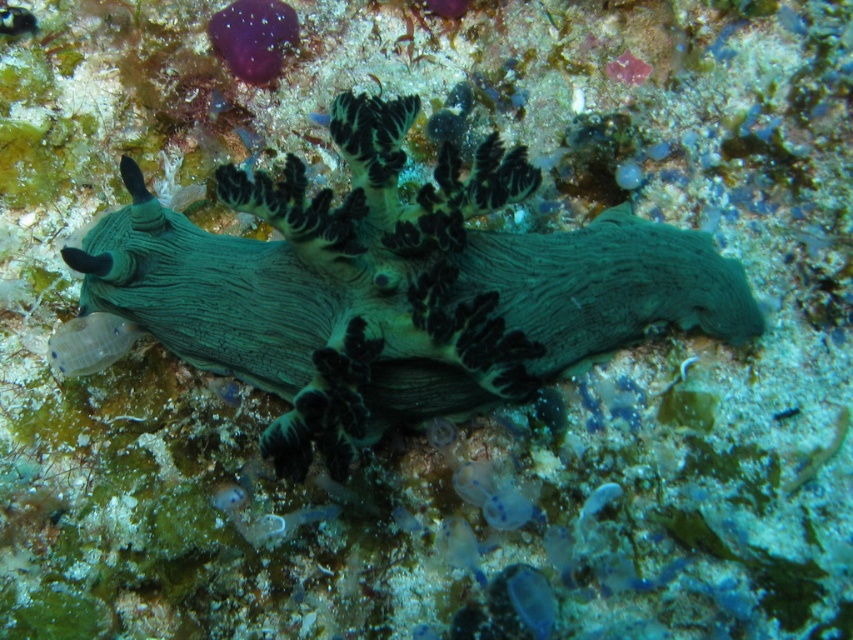
Question: Does purple rubbery sponge at upper center appear over translucent blue fish at upper center?

Choices:
 (A) yes
 (B) no

Answer: (A)

Question: Which point appears farthest from the camera in this image?

Choices:
 (A) (276, 26)
 (B) (322, 113)

Answer: (B)

Question: Which point appears closest to the camera in this image?

Choices:
 (A) (497, 493)
 (B) (280, 26)
 (C) (326, 118)

Answer: (A)

Question: In this image, where is purple rubbery sponge at upper center located relative to translucent gelatinous at left?

Choices:
 (A) right
 (B) left

Answer: (A)

Question: Which is nearer to the translucent blue fish at upper center?

Choices:
 (A) translucent gelatinous at left
 (B) purple rubbery sponge at upper center
 (C) green rubbery sea slug at center

Answer: (B)

Question: Is purple rubbery sponge at upper center positioned before translucent blue jellyfish at center?

Choices:
 (A) no
 (B) yes

Answer: (A)